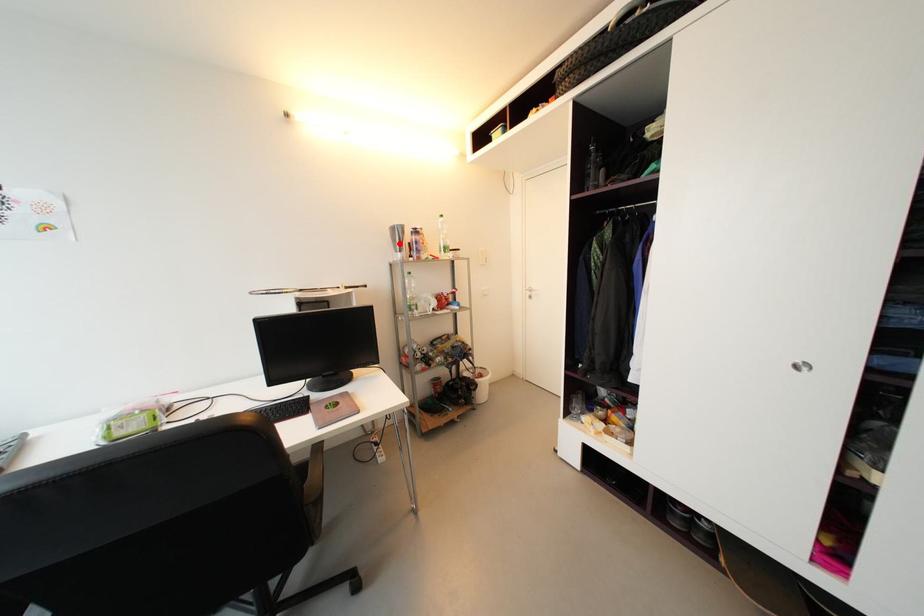
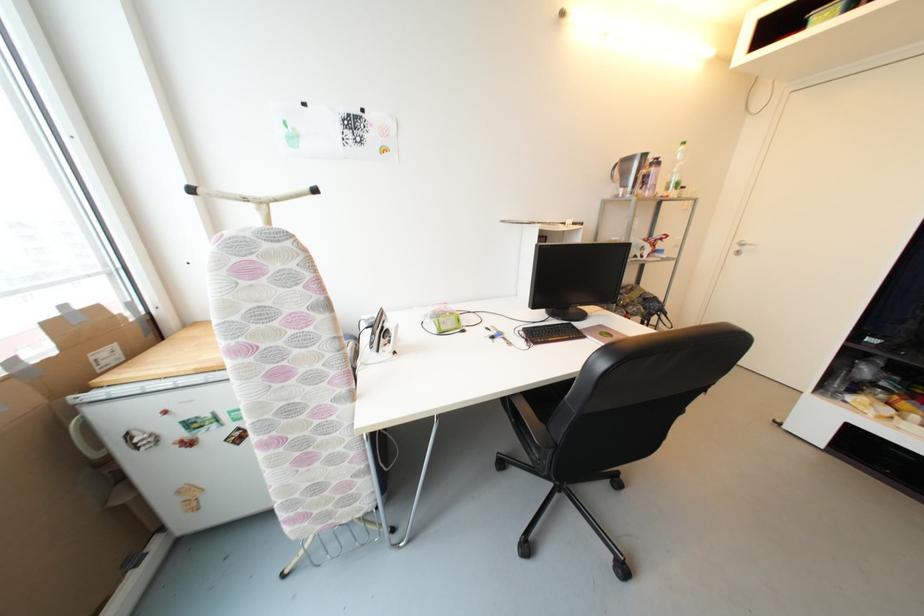
In the second image, find the point that corresponds to the highlighted location in the first image.

(629, 177)